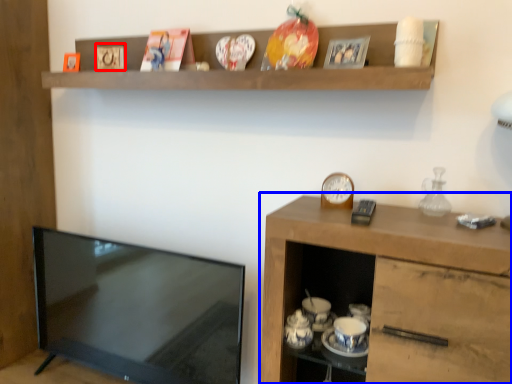
Question: Which of the following is the closest to the observer, picture frame (highlighted by a red box) or cabinetry (highlighted by a blue box)?

Choices:
 (A) picture frame
 (B) cabinetry

Answer: (B)